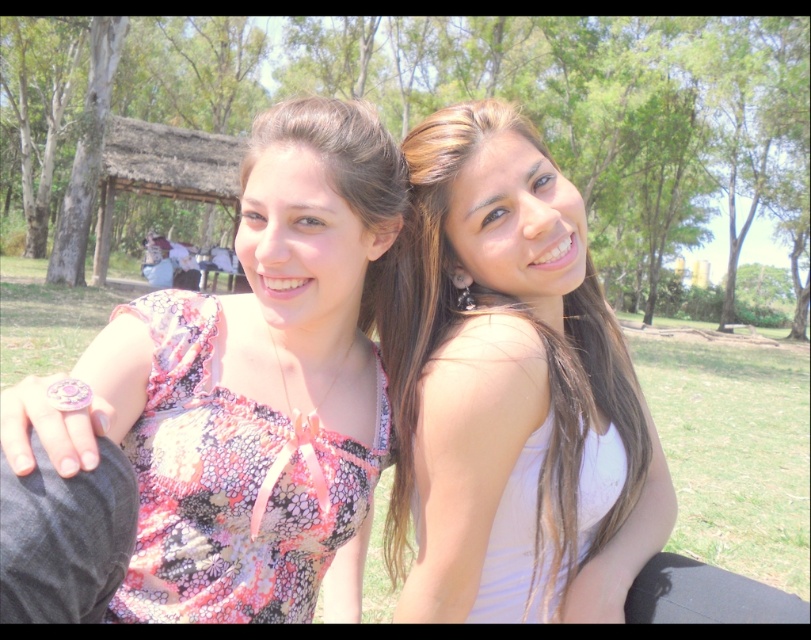
Question: Can you confirm if floral fabric dress at center is bigger than floral-patterned fabric dress at center?

Choices:
 (A) no
 (B) yes

Answer: (B)

Question: Which point is closer to the camera taking this photo?

Choices:
 (A) (608, 381)
 (B) (219, 584)
 (C) (159, 460)

Answer: (C)

Question: Is white matte tank top at right behind floral-patterned fabric dress at center?

Choices:
 (A) no
 (B) yes

Answer: (B)

Question: Which object is the farthest from the floral fabric dress at center?

Choices:
 (A) white matte tank top at right
 (B) floral-patterned fabric dress at center

Answer: (A)

Question: Which object appears closest to the camera in this image?

Choices:
 (A) white matte tank top at right
 (B) floral-patterned fabric dress at center
 (C) floral fabric dress at center

Answer: (C)

Question: Can you confirm if floral fabric dress at center is positioned above floral-patterned fabric dress at center?

Choices:
 (A) yes
 (B) no

Answer: (A)